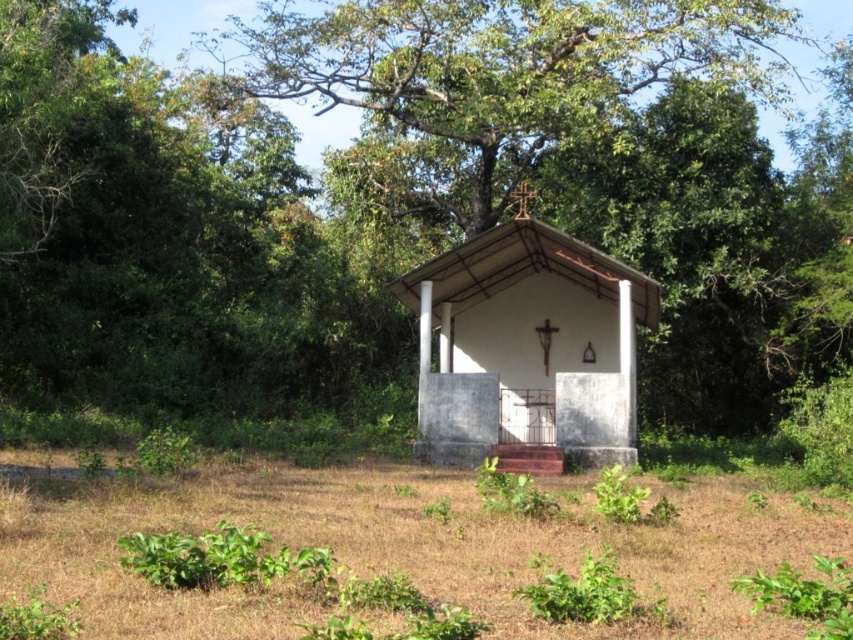
In the scene shown: Does green leafy tree at center have a greater width compared to white concrete hut at center?

Indeed, green leafy tree at center has a greater width compared to white concrete hut at center.

Between point (460, 220) and point (422, 445), which one is positioned behind?

Positioned behind is point (460, 220).

Looking at this image, who is more distant from viewer, (62, 29) or (628, 333)?

The point (62, 29) is behind.

What are the coordinates of `green leafy tree at center` in the screenshot? It's located at (386, 220).

Which is in front, point (309, 314) or point (460, 572)?

Point (460, 572) is more forward.

Does green leafy tree at center lie behind brown dry grass at center?

That is True.

Is point (277, 205) farther from viewer compared to point (202, 636)?

Yes, it is behind point (202, 636).

This screenshot has height=640, width=853. What are the coordinates of `green leafy tree at center` in the screenshot? It's located at (386, 220).

Between brown dry grass at center and white concrete hut at center, which one appears on the left side from the viewer's perspective?

From the viewer's perspective, brown dry grass at center appears more on the left side.

Is brown dry grass at center below white concrete hut at center?

Indeed, brown dry grass at center is positioned under white concrete hut at center.

Find the location of a particular element. brown dry grass at center is located at coordinates (412, 547).